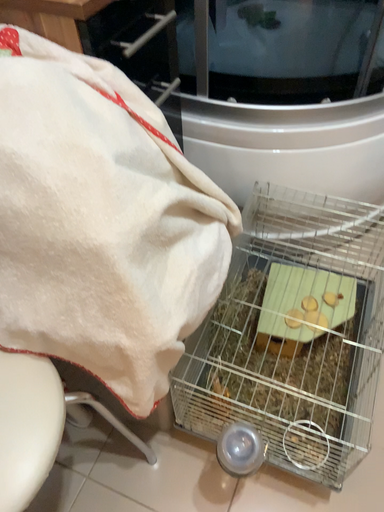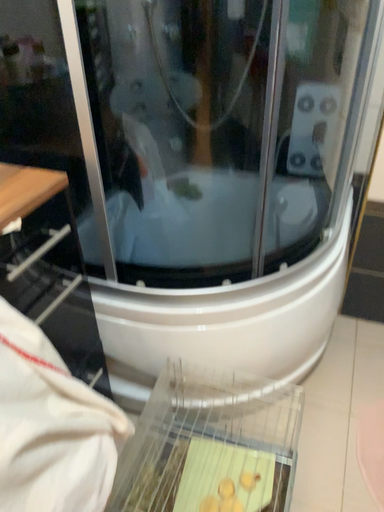
Question: Which way did the camera rotate in the video?

Choices:
 (A) rotated downward
 (B) rotated upward

Answer: (B)